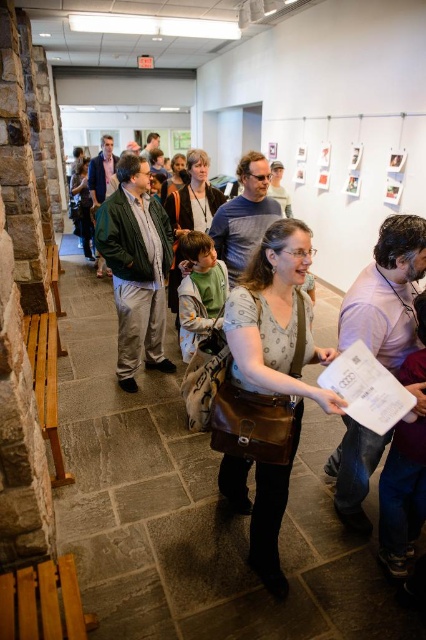
Question: Does matte brown bag at center appear on the right side of green matte jacket at center?

Choices:
 (A) yes
 (B) no

Answer: (A)

Question: Does matte brown bag at center appear on the right side of green matte jacket at center?

Choices:
 (A) yes
 (B) no

Answer: (A)

Question: Can you confirm if matte brown bag at center is positioned to the left of green matte jacket at center?

Choices:
 (A) no
 (B) yes

Answer: (A)

Question: Among these points, which one is nearest to the camera?

Choices:
 (A) (152, 280)
 (B) (273, 332)

Answer: (B)

Question: Which object appears closest to the camera in this image?

Choices:
 (A) matte brown bag at center
 (B) green matte jacket at center

Answer: (A)